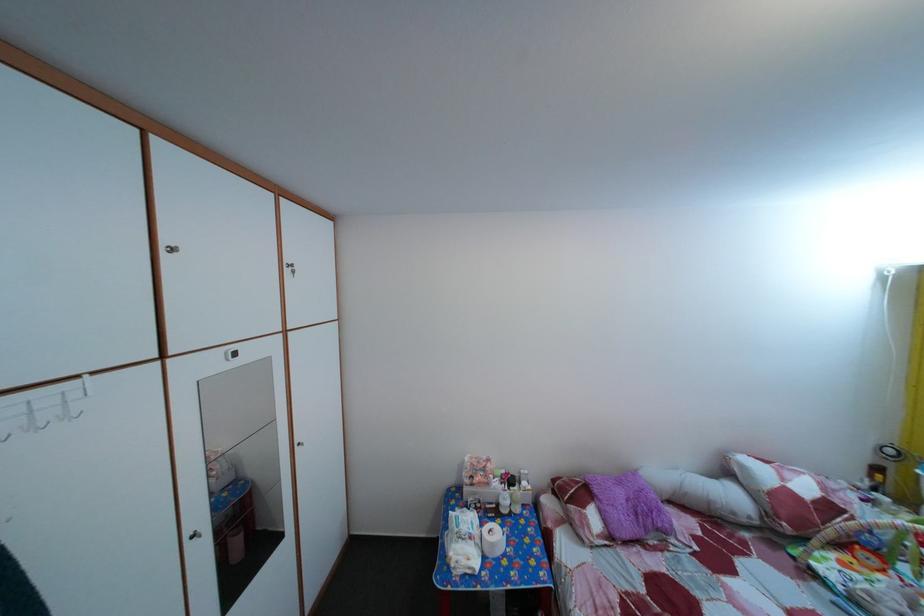
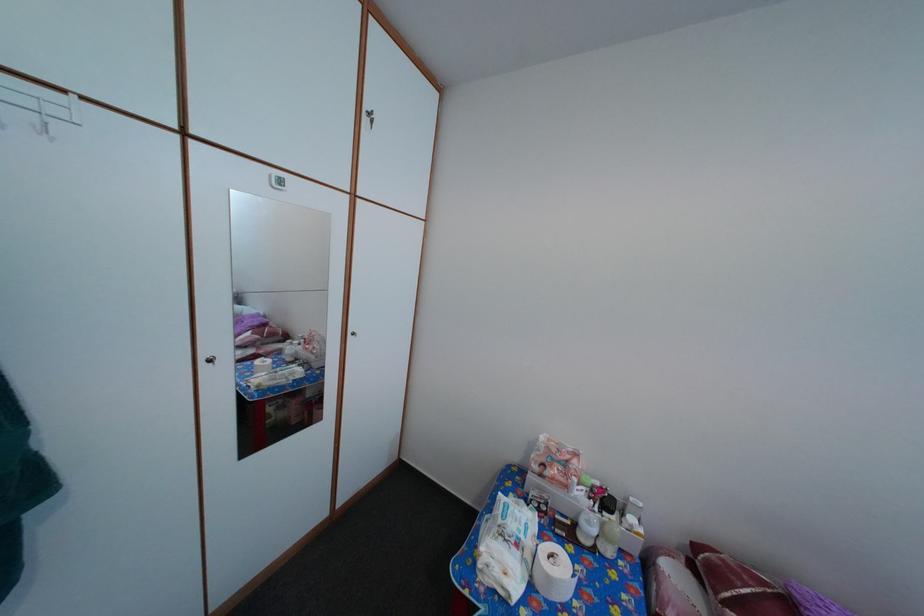
Locate, in the second image, the point that corresponds to (x=84, y=403) in the first image.

(66, 120)